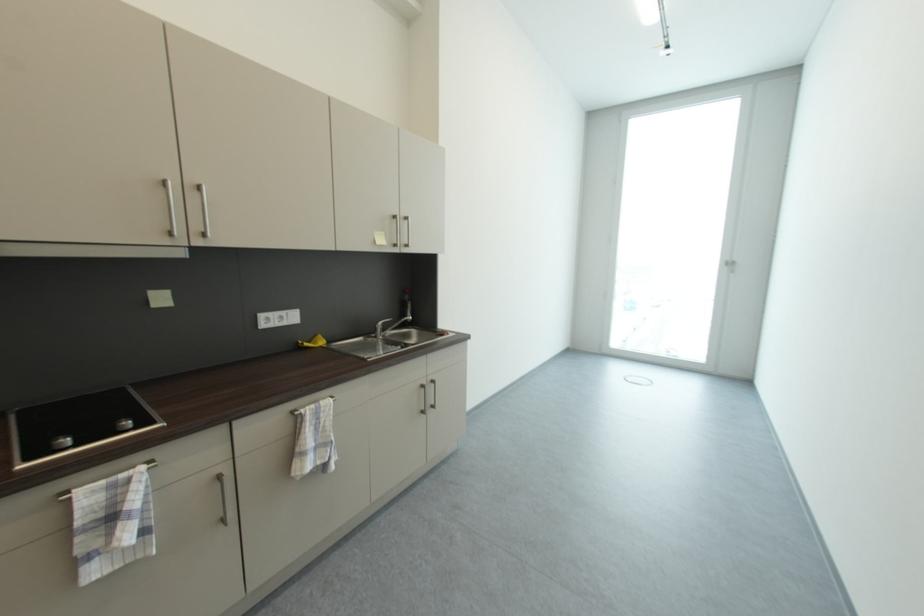
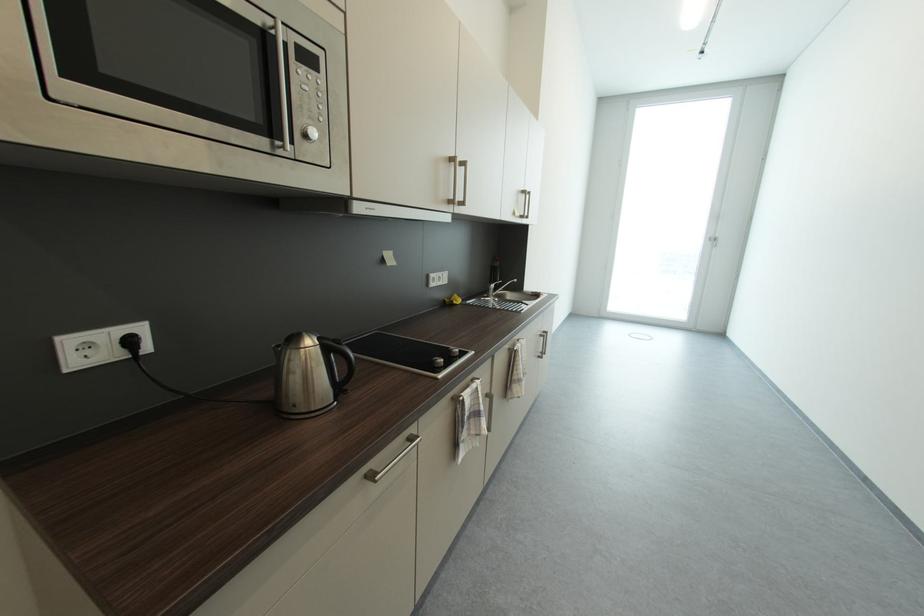
Question: What movement of the cameraman would produce the second image?

Choices:
 (A) Left
 (B) Right
 (C) Forward
 (D) Backward

Answer: (A)